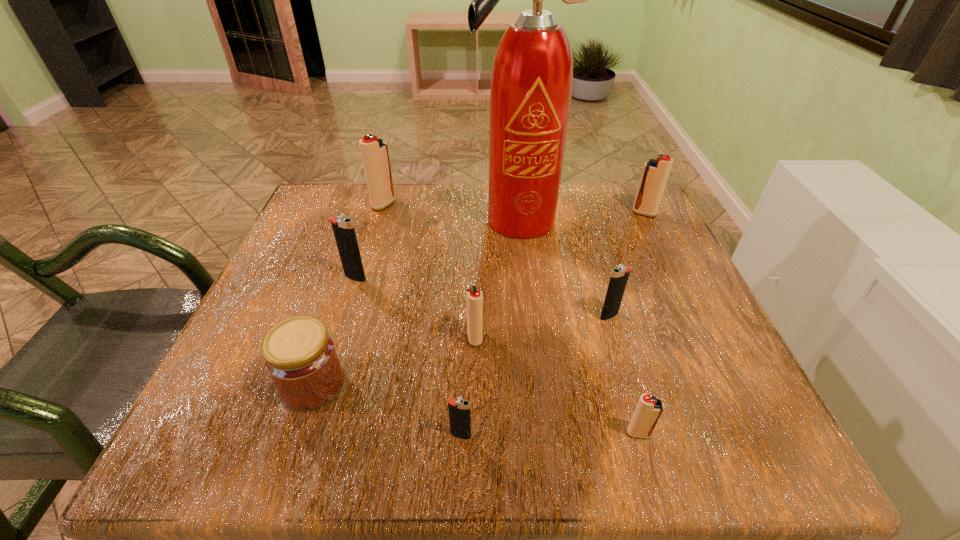
In the image, there is a desktop. Where is `free space at the near right corner`? The image size is (960, 540). free space at the near right corner is located at coordinates (671, 409).

The height and width of the screenshot is (540, 960). I want to click on free space that is in between the nearest black igniter and the rightmost igniter, so click(x=553, y=324).

Find the location of `free spot between the red jam and the smallest red igniter`. free spot between the red jam and the smallest red igniter is located at coordinates (476, 409).

The image size is (960, 540). Find the location of `free space between the fire extinguisher and the nearest red igniter`. free space between the fire extinguisher and the nearest red igniter is located at coordinates (577, 327).

I want to click on vacant area between the red fire extinguisher and the fifth nearest object, so click(563, 268).

At what (x,y) coordinates should I click in order to perform the action: click on empty space between the second biggest black igniter and the second black igniter from left to right. Please return your answer as a coordinate pair (x, y). This screenshot has height=540, width=960. Looking at the image, I should click on (535, 375).

The height and width of the screenshot is (540, 960). In order to click on unoccupied area between the second red igniter from right to left and the nearest black igniter in this screenshot , I will do `click(550, 434)`.

You are a GUI agent. You are given a task and a screenshot of the screen. Output one action in this format:
    pyautogui.click(x=<x>, y=<y>)
    Task: Click on the empty location between the fifth nearest igniter and the rightmost object
    The image size is (960, 540).
    Given the screenshot: What is the action you would take?
    pyautogui.click(x=500, y=245)

You are a GUI agent. You are given a task and a screenshot of the screen. Output one action in this format:
    pyautogui.click(x=<x>, y=<y>)
    Task: Click on the unoccupied area between the second smallest black igniter and the fourth nearest object
    The image size is (960, 540).
    Given the screenshot: What is the action you would take?
    pyautogui.click(x=542, y=327)

Where is `object that is the closest one to the third smallest red igniter`? The width and height of the screenshot is (960, 540). object that is the closest one to the third smallest red igniter is located at coordinates (531, 84).